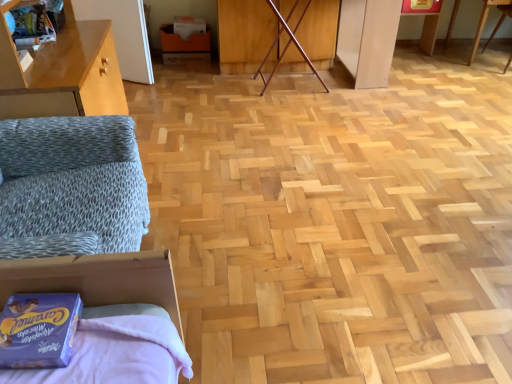
Question: From the image's perspective, is wooden table at upper right on matte cardboard box at center?

Choices:
 (A) no
 (B) yes

Answer: (A)

Question: Is wooden table at upper right oriented away from matte cardboard box at center?

Choices:
 (A) no
 (B) yes

Answer: (A)

Question: From the image's perspective, is wooden table at upper right beneath matte cardboard box at center?

Choices:
 (A) no
 (B) yes

Answer: (B)

Question: Does wooden table at upper right come in front of matte cardboard box at center?

Choices:
 (A) no
 (B) yes

Answer: (B)

Question: Is wooden table at upper right bigger than matte cardboard box at center?

Choices:
 (A) yes
 (B) no

Answer: (A)

Question: Considering the positions of blue cardboard box at lower left and matte cardboard box at center in the image, is blue cardboard box at lower left taller or shorter than matte cardboard box at center?

Choices:
 (A) short
 (B) tall

Answer: (A)

Question: From a real-world perspective, is blue cardboard box at lower left above or below matte cardboard box at center?

Choices:
 (A) below
 (B) above

Answer: (B)

Question: Based on their sizes in the image, would you say blue cardboard box at lower left is bigger or smaller than matte cardboard box at center?

Choices:
 (A) big
 (B) small

Answer: (B)

Question: Is point (53, 311) closer or farther from the camera than point (205, 44)?

Choices:
 (A) farther
 (B) closer

Answer: (B)

Question: From the image's perspective, is matte cardboard box at center above or below blue cardboard box at lower left?

Choices:
 (A) below
 (B) above

Answer: (B)

Question: Based on their positions, is matte cardboard box at center located to the left or right of blue cardboard box at lower left?

Choices:
 (A) right
 (B) left

Answer: (B)

Question: In terms of size, does matte cardboard box at center appear bigger or smaller than blue cardboard box at lower left?

Choices:
 (A) big
 (B) small

Answer: (A)

Question: In the image, is matte cardboard box at center positioned in front of or behind blue cardboard box at lower left?

Choices:
 (A) behind
 (B) front

Answer: (A)

Question: In terms of width, does blue cardboard box at lower left look wider or thinner when compared to wooden table at upper right?

Choices:
 (A) thin
 (B) wide

Answer: (A)

Question: Considering the positions of blue cardboard box at lower left and wooden table at upper right in the image, is blue cardboard box at lower left bigger or smaller than wooden table at upper right?

Choices:
 (A) small
 (B) big

Answer: (A)